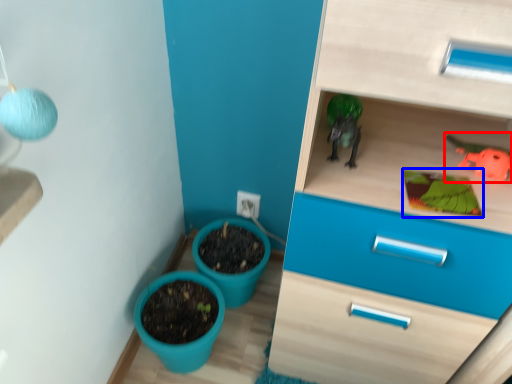
Question: Among these objects, which one is nearest to the camera, toy (highlighted by a red box) or plant (highlighted by a blue box)?

Choices:
 (A) toy
 (B) plant

Answer: (B)